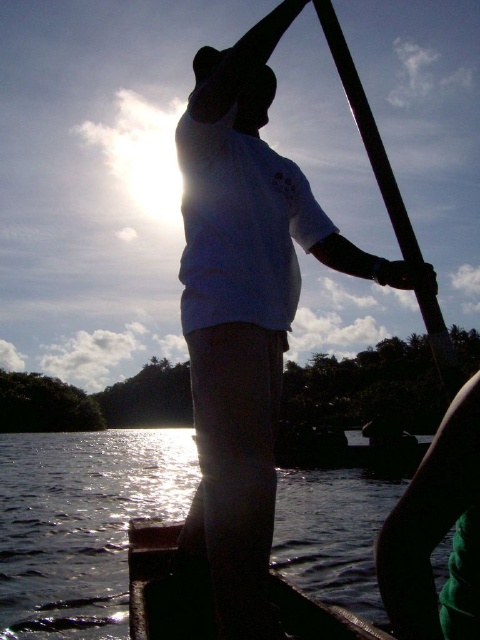
You are a photographer trying to capture the silhouette of the rower. You notice the dark wood boat at center and the smooth black pole at upper center in your viewfinder. Which object should you focus on to ensure the silhouette of the rower is properly framed?

The dark wood boat at center has a smaller size compared to the smooth black pole at upper center. Therefore, focusing on the larger smooth black pole at upper center will help frame the rower more effectively.

You are a photographer trying to capture the silhouette of the person rowing. You want to ensure that the white matte shirt at center and the dark wood boat at center are both clearly visible in the frame. Given the distance between them, is there a risk that the shirt might appear too bright compared to the boat?

The distance between the white matte shirt at center and the dark wood boat at center is 35.63 inches. Since the shirt is closer to the camera than the boat, it may appear brighter in the silhouette due to its proximity, potentially causing it to stand out more against the darker boat.

You are a photographer aiming to capture the silhouette of the person rowing the dark wood boat at center. To ensure the smooth black pole at upper center doesn not block the boat in the photo, where should you position the boat relative to the pole?

The dark wood boat at center is below the smooth black pole at upper center, so positioning the boat slightly lower in the frame will keep it from being blocked by the pole.